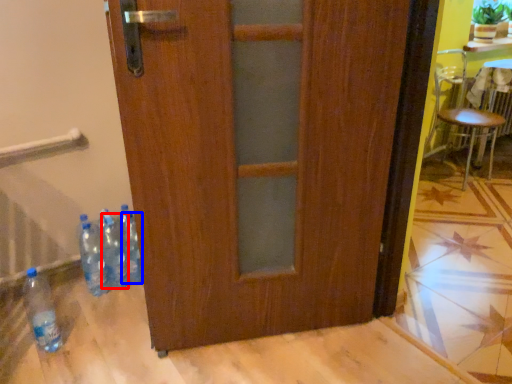
Question: Which object is further to the camera taking this photo, bottle (highlighted by a red box) or bottle (highlighted by a blue box)?

Choices:
 (A) bottle
 (B) bottle

Answer: (B)